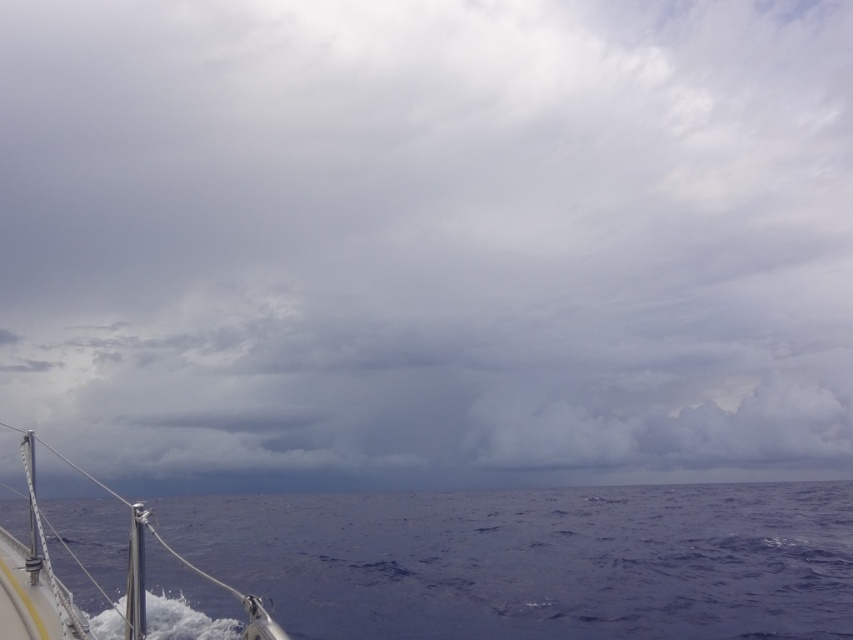
Question: Among these points, which one is nearest to the camera?

Choices:
 (A) (265, 612)
 (B) (416, 605)

Answer: (A)

Question: Does deep blue water at lower center appear over polished metal boat at lower left?

Choices:
 (A) yes
 (B) no

Answer: (A)

Question: Does deep blue water at lower center appear on the right side of polished metal boat at lower left?

Choices:
 (A) yes
 (B) no

Answer: (A)

Question: From the image, what is the correct spatial relationship of deep blue water at lower center in relation to polished metal boat at lower left?

Choices:
 (A) below
 (B) above

Answer: (B)